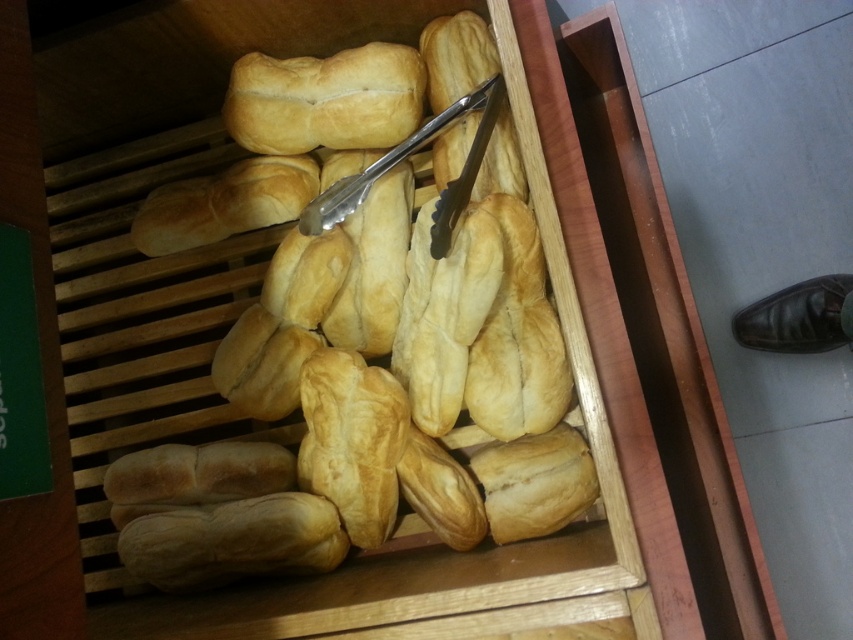
Who is more forward, (x=149, y=518) or (x=310, y=208)?

Point (x=149, y=518) is more forward.

Find the location of `golden-brown crusty bread at center`. golden-brown crusty bread at center is located at coordinates (370, 401).

Between point (305, 506) and point (343, 104), which one is positioned behind?

Positioned behind is point (343, 104).

Does golden-brown crusty bread at center appear on the left side of golden brown crusty loaf at center?

No, golden-brown crusty bread at center is not to the left of golden brown crusty loaf at center.

Is point (326, 440) closer to viewer compared to point (329, 84)?

Yes.

The width and height of the screenshot is (853, 640). I want to click on golden-brown crusty bread at center, so click(370, 401).

Is golden brown crusty loaf at center above silver metallic tong at center?

Yes.

Can you confirm if golden brown crusty loaf at center is bigger than silver metallic tong at center?

Actually, golden brown crusty loaf at center might be smaller than silver metallic tong at center.

This screenshot has width=853, height=640. I want to click on golden brown crusty loaf at center, so click(325, 99).